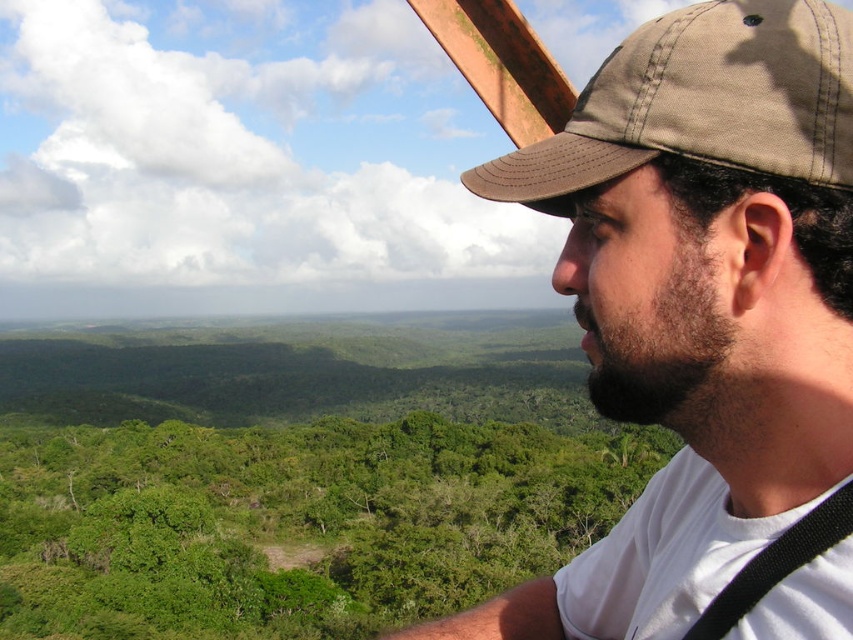
Does brown fabric cap at upper right have a greater height compared to green leafy trees at center?

Yes.

Is brown fabric cap at upper right above green leafy trees at center?

Yes, brown fabric cap at upper right is above green leafy trees at center.

Is point (585, 305) closer to camera compared to point (171, 627)?

Yes, it is in front of point (171, 627).

Find the location of a particular element. The width and height of the screenshot is (853, 640). brown fabric cap at upper right is located at coordinates click(698, 301).

Between brown fabric cap at upper right and brown canvas baseball cap at upper right, which one has more height?

brown fabric cap at upper right is taller.

Based on the photo, who is lower down, brown fabric cap at upper right or brown canvas baseball cap at upper right?

brown fabric cap at upper right is lower down.

Is point (831, 480) positioned in front of point (573, 172)?

Yes.

Image resolution: width=853 pixels, height=640 pixels. What are the coordinates of `brown fabric cap at upper right` in the screenshot? It's located at (698, 301).

Who is taller, green leafy trees at center or brown canvas baseball cap at upper right?

With more height is green leafy trees at center.

Is green leafy trees at center smaller than brown canvas baseball cap at upper right?

Incorrect, green leafy trees at center is not smaller in size than brown canvas baseball cap at upper right.

Between point (550, 504) and point (817, 92), which one is positioned behind?

Positioned behind is point (550, 504).

In order to click on green leafy trees at center in this screenshot , I will do `click(294, 522)`.